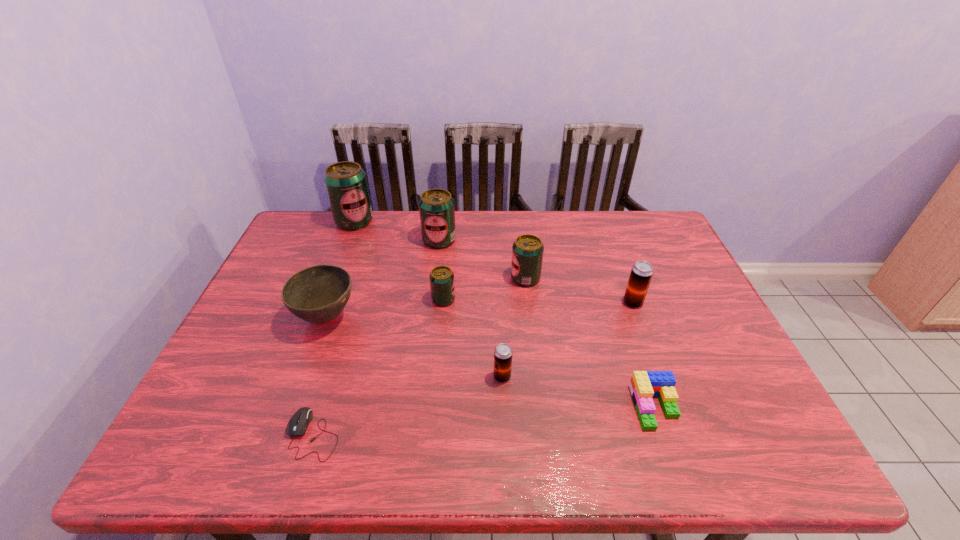
Choose which green beer can is the nearest neighbor to the bowl. Please provide its 2D coordinates. Your answer should be formatted as a tuple, i.e. [(x, y)], where the tuple contains the x and y coordinates of a point satisfying the conditions above.

[(442, 286)]

The image size is (960, 540). What are the coordinates of `vacant space that satisfies the following two spatial constraints: 1. on the front side of the tallest beer can; 2. on the left side of the seventh object from left to right` in the screenshot? It's located at (332, 278).